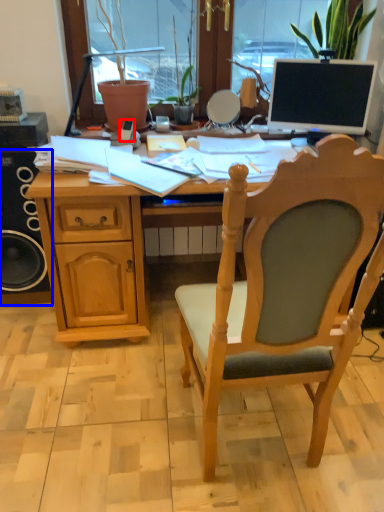
Question: Which point is further to the camera, mobile phone (highlighted by a red box) or loudspeaker (highlighted by a blue box)?

Choices:
 (A) mobile phone
 (B) loudspeaker

Answer: (A)